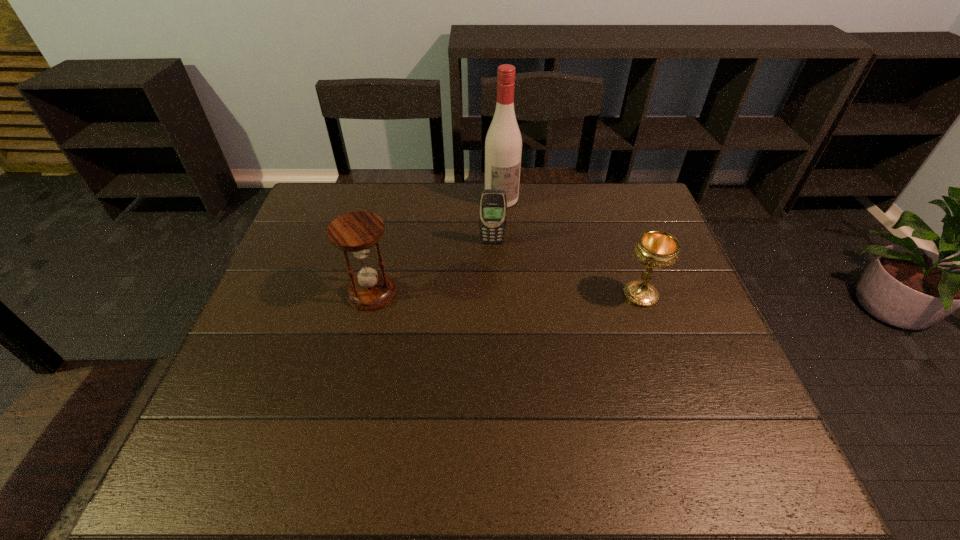
Identify which object is the second nearest to the cellular telephone. Please provide its 2D coordinates. Your answer should be formatted as a tuple, i.e. [(x, y)], where the tuple contains the x and y coordinates of a point satisfying the conditions above.

[(357, 232)]

Identify the location of the third closest object to the third nearest object. The width and height of the screenshot is (960, 540). (656, 249).

This screenshot has height=540, width=960. What are the coordinates of `free space that satisfies the following two spatial constraints: 1. on the front side of the cellular telephone; 2. on the right side of the rightmost object` in the screenshot? It's located at (493, 295).

Locate an element on the screen. blank space that satisfies the following two spatial constraints: 1. on the back side of the cellular telephone; 2. on the right side of the second tallest object is located at coordinates [x=384, y=242].

Identify the location of free location that satisfies the following two spatial constraints: 1. on the back side of the hourglass; 2. on the left side of the cellular telephone. This screenshot has height=540, width=960. (384, 242).

Where is `free space in the image that satisfies the following two spatial constraints: 1. on the front side of the chalice; 2. on the right side of the cellular telephone`? The image size is (960, 540). free space in the image that satisfies the following two spatial constraints: 1. on the front side of the chalice; 2. on the right side of the cellular telephone is located at coordinates (493, 295).